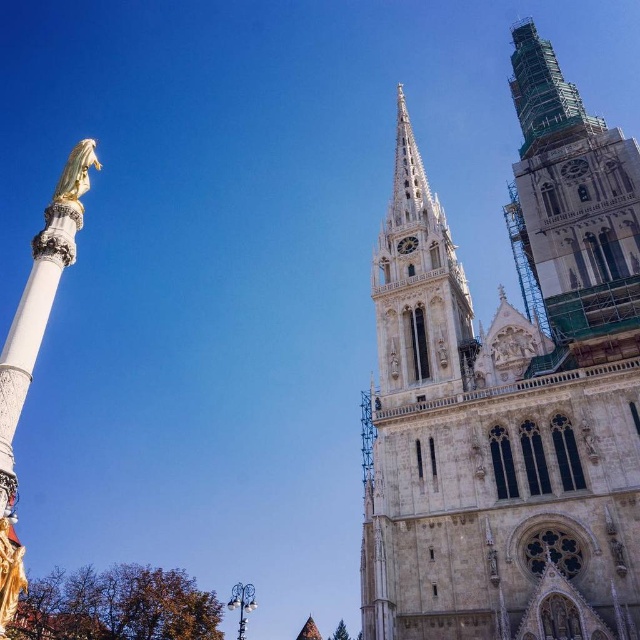
Is point (602, 198) closer to camera compared to point (92, 141)?

No, (602, 198) is behind (92, 141).

Between point (586, 269) and point (99, 164), which one is positioned in front?

Point (586, 269) is more forward.

Which is behind, point (570, 266) or point (81, 180)?

Positioned behind is point (570, 266).

Identify the location of green scaffolding at right. The width and height of the screenshot is (640, 640). (573, 198).

Which is more to the right, white marble column at left or gold polished statue at left?

gold polished statue at left is more to the right.

This screenshot has height=640, width=640. What do you see at coordinates (32, 330) in the screenshot?
I see `white marble column at left` at bounding box center [32, 330].

Which is behind, point (8, 365) or point (65, 182)?

The point (65, 182) is more distant.

At what (x,y) coordinates should I click in order to perform the action: click on white marble column at left. Please return your answer as a coordinate pair (x, y). This screenshot has width=640, height=640. Looking at the image, I should click on (32, 330).

Does stone spire at center appear on the right side of gold polished statue at left?

Correct, you'll find stone spire at center to the right of gold polished statue at left.

The width and height of the screenshot is (640, 640). I want to click on stone spire at center, so click(x=419, y=289).